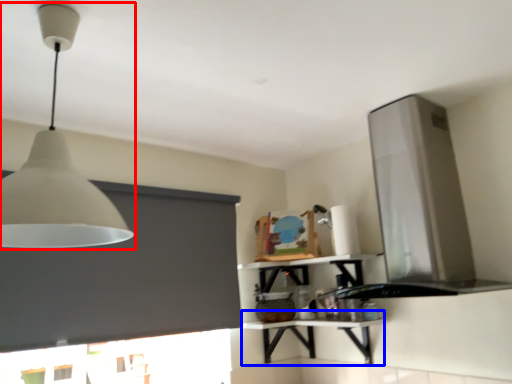
Question: Which point is further to the camera, lamp (highlighted by a red box) or table (highlighted by a blue box)?

Choices:
 (A) lamp
 (B) table

Answer: (B)